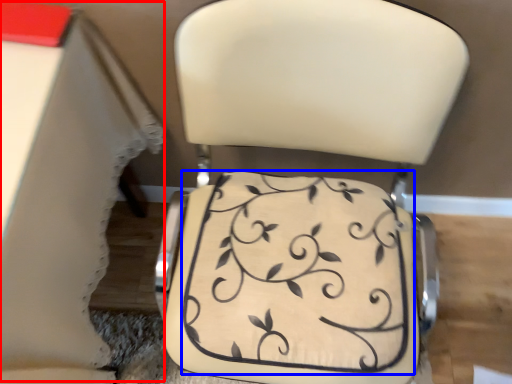
Question: Which of the following is the closest to the observer, table (highlighted by a red box) or wedding cake (highlighted by a blue box)?

Choices:
 (A) table
 (B) wedding cake

Answer: (A)